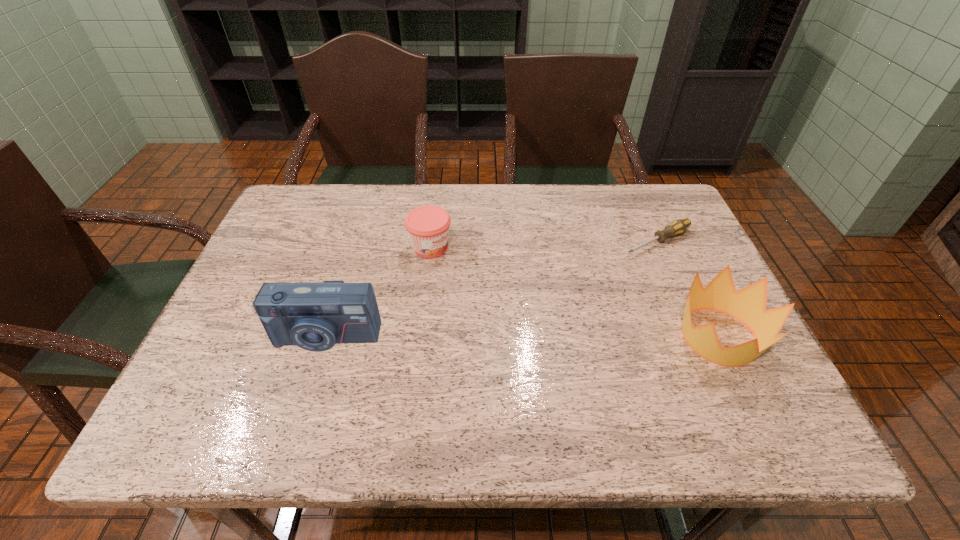
The width and height of the screenshot is (960, 540). Find the location of `free space at the far edge`. free space at the far edge is located at coordinates (484, 197).

This screenshot has width=960, height=540. What are the coordinates of `free space at the near edge of the desktop` in the screenshot? It's located at (535, 372).

Where is `vacant area at the left edge`? The width and height of the screenshot is (960, 540). vacant area at the left edge is located at coordinates (263, 253).

Identify the location of vacant space at the right edge. This screenshot has width=960, height=540. (668, 277).

The width and height of the screenshot is (960, 540). I want to click on vacant space at the far left corner of the desktop, so click(278, 225).

Find the location of a particular element. The height and width of the screenshot is (540, 960). free space at the near left corner of the desktop is located at coordinates (187, 392).

At what (x,y) coordinates should I click in order to perform the action: click on free space at the far right corner. Please return your answer as a coordinate pair (x, y). The width and height of the screenshot is (960, 540). Looking at the image, I should click on (641, 200).

The image size is (960, 540). What are the coordinates of `free space between the camera and the screwdriver` in the screenshot? It's located at (492, 289).

Image resolution: width=960 pixels, height=540 pixels. I want to click on empty space that is in between the camera and the second shortest object, so click(378, 292).

You are a GUI agent. You are given a task and a screenshot of the screen. Output one action in this format:
    pyautogui.click(x=<x>, y=<y>)
    Task: Click on the free space between the leftmost object and the screwdriver
    Image resolution: width=960 pixels, height=540 pixels.
    Given the screenshot: What is the action you would take?
    pyautogui.click(x=492, y=289)